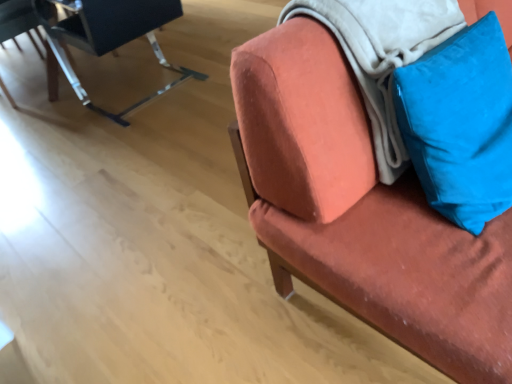
At what (x,y) coordinates should I click in order to perform the action: click on free space behind metallic black chair at upper left, the second chair from the left. Please return your answer as a coordinate pair (x, y). Image resolution: width=512 pixels, height=384 pixels. Looking at the image, I should click on (144, 56).